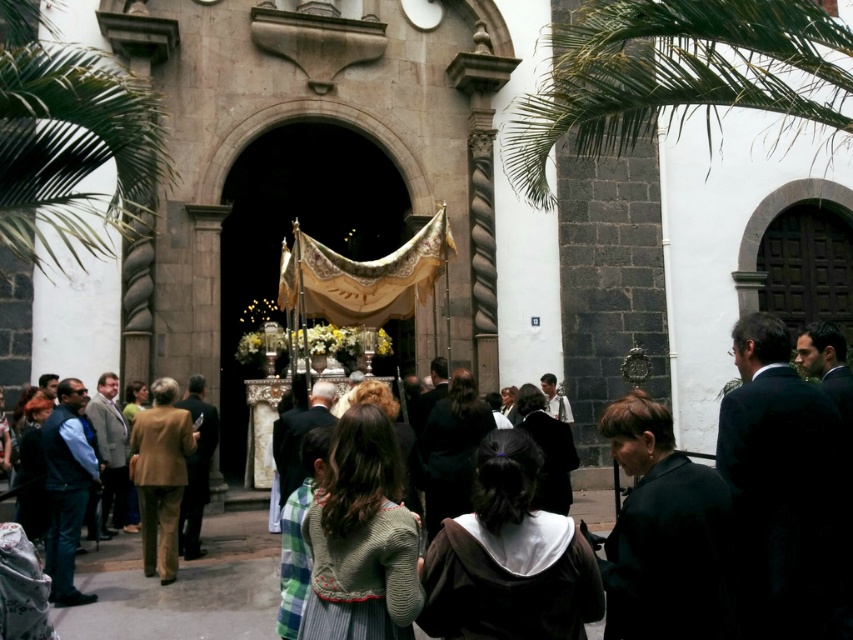
Who is shorter, green leafy palm tree at upper right or brown fabric jacket at center?

With less height is brown fabric jacket at center.

Who is more forward, (599, 92) or (148, 426)?

Point (148, 426) is in front.

Locate an element on the screen. This screenshot has width=853, height=640. green leafy palm tree at upper right is located at coordinates (680, 76).

Between point (670, 528) and point (592, 616), which one is positioned in front?

Point (592, 616) is in front.

Which is below, black matte jacket at lower right or dark brown hoodie at center?

dark brown hoodie at center is lower down.

Is point (662, 420) positioned behind point (529, 452)?

Yes, it is behind point (529, 452).

Where is `black matte jacket at lower right`? Image resolution: width=853 pixels, height=640 pixels. black matte jacket at lower right is located at coordinates (666, 536).

The height and width of the screenshot is (640, 853). What do you see at coordinates (508, 557) in the screenshot? I see `dark brown hoodie at center` at bounding box center [508, 557].

Is dark brown hoodie at center taller than brown fabric jacket at center?

Incorrect, dark brown hoodie at center's height is not larger of brown fabric jacket at center's.

Does point (498, 588) come behind point (175, 454)?

No, it is in front of (175, 454).

Identify the location of dark brown hoodie at center. This screenshot has height=640, width=853. (508, 557).